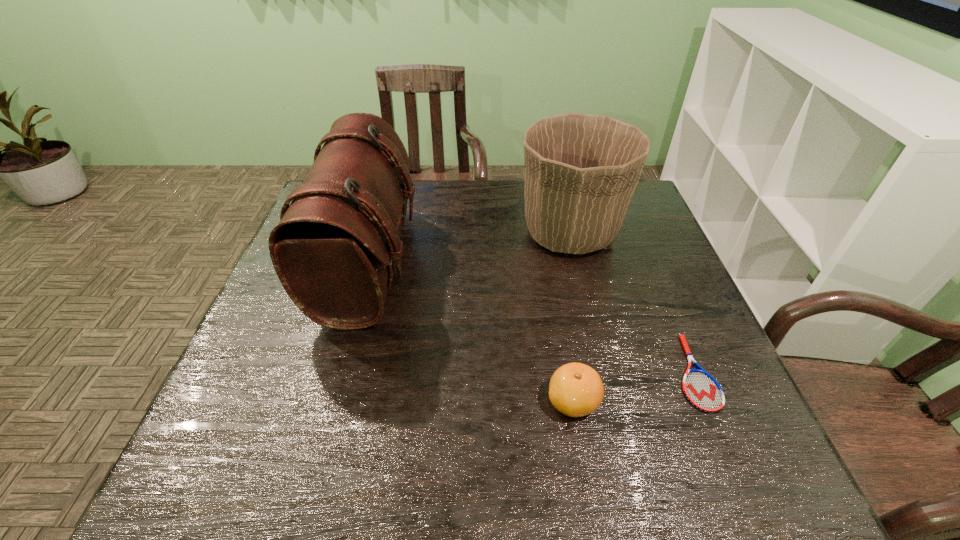
Where is `object present at the left edge`? object present at the left edge is located at coordinates click(x=334, y=248).

This screenshot has width=960, height=540. Find the location of `flowerpot located in the right edge section of the desktop`. flowerpot located in the right edge section of the desktop is located at coordinates (581, 170).

In order to click on tennis racket that is positioned at the right edge in this screenshot , I will do `click(700, 388)`.

Identify the location of object at the far left corner. (334, 248).

What are the coordinates of `object that is at the far right corner` in the screenshot? It's located at (581, 170).

Find the location of a particular element. Image resolution: width=960 pixels, height=540 pixels. free space at the far edge of the desktop is located at coordinates (439, 197).

This screenshot has height=540, width=960. In the image, there is a desktop. What are the coordinates of `vacant space at the near edge` in the screenshot? It's located at (539, 488).

Locate an element on the screen. The width and height of the screenshot is (960, 540). vacant space at the right edge of the desktop is located at coordinates (677, 268).

What are the coordinates of `blank space at the far right corner` in the screenshot? It's located at (648, 210).

At what (x,y) coordinates should I click in order to perform the action: click on vacant space at the near right corner of the desktop. Please return your answer as a coordinate pair (x, y). Looking at the image, I should click on (699, 454).